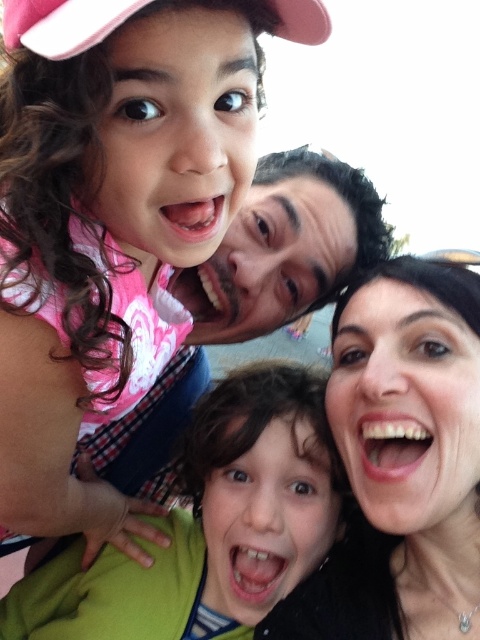
Which is more to the right, smooth skin face at upper right or matte black face at center?

Positioned to the right is smooth skin face at upper right.

Find the location of `smooth skin face at upper right`. smooth skin face at upper right is located at coordinates (402, 461).

Does pink fabric at upper left have a greater width compared to matte black face at center?

Yes, pink fabric at upper left is wider than matte black face at center.

Does point (90, 104) come closer to viewer compared to point (296, 154)?

Yes, it is in front of point (296, 154).

Locate an element on the screen. Image resolution: width=480 pixels, height=640 pixels. pink fabric at upper left is located at coordinates (110, 218).

Which of these two, smooth skin face at upper right or green fabric shirt at center, stands taller?

With more height is smooth skin face at upper right.

Between point (450, 593) and point (214, 595), which one is positioned behind?

Positioned behind is point (214, 595).

I want to click on smooth skin face at upper right, so click(402, 461).